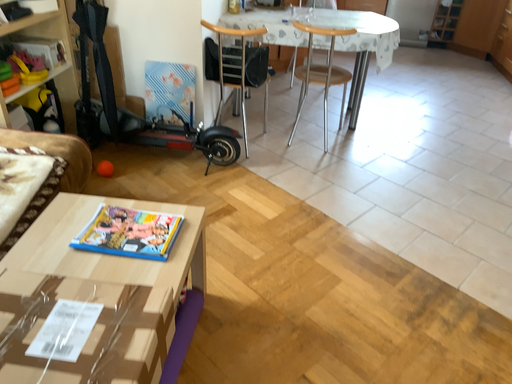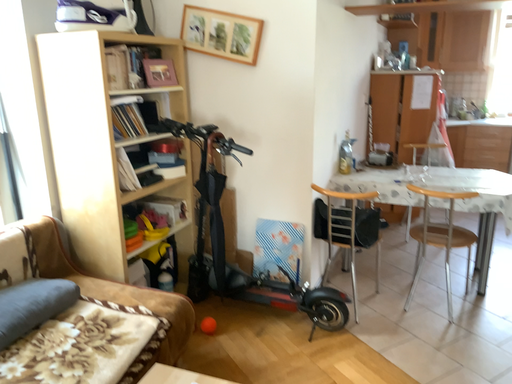
Question: Which way did the camera rotate in the video?

Choices:
 (A) rotated left
 (B) rotated right

Answer: (A)